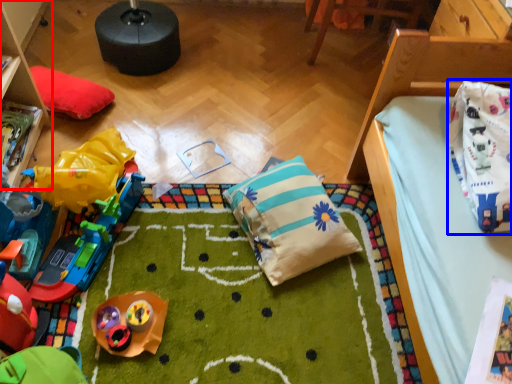
Question: Which object appears closest to the camera in this image, furniture (highlighted by a red box) or material (highlighted by a blue box)?

Choices:
 (A) furniture
 (B) material

Answer: (B)